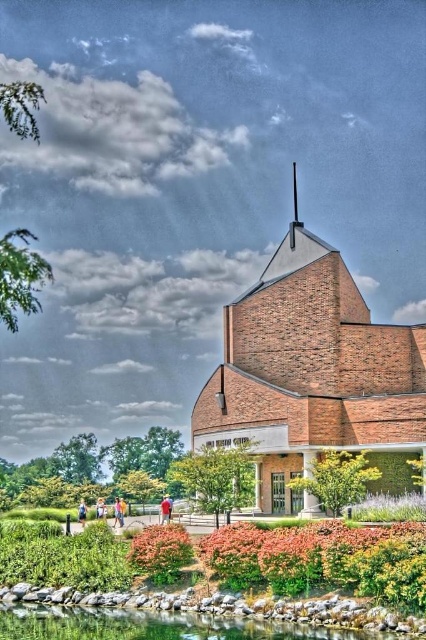
Identify the location of red shirt at center. (164, 509).

Which is in front, point (161, 520) or point (114, 515)?

Point (161, 520)

Where is `red shirt at center`? This screenshot has width=426, height=640. red shirt at center is located at coordinates (164, 509).

Does pink fabric dress at lower center appear on the left side of light blue denim jeans at lower left?

Incorrect, pink fabric dress at lower center is not on the left side of light blue denim jeans at lower left.

Who is positioned more to the right, pink fabric dress at lower center or light blue denim jeans at lower left?

Positioned to the right is pink fabric dress at lower center.

Where is `pink fabric dress at lower center`? The width and height of the screenshot is (426, 640). pink fabric dress at lower center is located at coordinates (117, 513).

Can you confirm if orange matte flower at lower center is positioned above light blue denim jeans at lower left?

Correct, orange matte flower at lower center is located above light blue denim jeans at lower left.

Who is shorter, orange matte flower at lower center or light blue denim jeans at lower left?

Standing shorter between the two is orange matte flower at lower center.

You are a GUI agent. You are given a task and a screenshot of the screen. Output one action in this format:
    pyautogui.click(x=<x>, y=<y>)
    Task: Click on the orange matte flower at lower center
    The image size is (426, 640).
    Given the screenshot: What is the action you would take?
    pyautogui.click(x=160, y=548)

You are a GUI agent. You are given a task and a screenshot of the screen. Output one action in this format:
    pyautogui.click(x=<x>, y=<y>)
    Task: Click on the orange matte flower at lower center
    
    Given the screenshot: What is the action you would take?
    pyautogui.click(x=160, y=548)